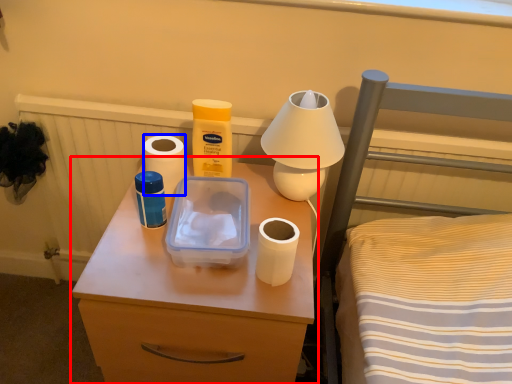
Question: Among these objects, which one is farthest to the camera, nightstand (highlighted by a red box) or toilet paper (highlighted by a blue box)?

Choices:
 (A) nightstand
 (B) toilet paper

Answer: (B)